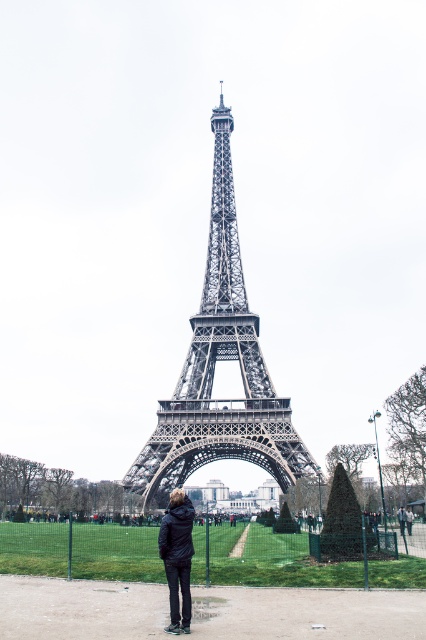
Between metallic structure at center and green grass at lower center, which one appears on the right side from the viewer's perspective?

metallic structure at center is more to the right.

Does metallic structure at center appear over green grass at lower center?

Correct, metallic structure at center is located above green grass at lower center.

Is point (203, 371) positioned before point (63, 531)?

Yes.

The image size is (426, 640). In order to click on metallic structure at center in this screenshot , I will do `click(213, 369)`.

What do you see at coordinates (213, 369) in the screenshot? The image size is (426, 640). I see `metallic structure at center` at bounding box center [213, 369].

Can you confirm if metallic structure at center is smaller than black matte jacket at lower center?

Actually, metallic structure at center might be larger than black matte jacket at lower center.

Is point (267, 461) farther from camera compared to point (158, 541)?

That is True.

The width and height of the screenshot is (426, 640). In order to click on metallic structure at center in this screenshot , I will do `click(213, 369)`.

Does point (0, 568) lie behind point (175, 612)?

Yes.

Which is behind, point (337, 566) or point (166, 532)?

Point (337, 566)

Find the location of a particular element. This screenshot has height=640, width=426. green grass at lower center is located at coordinates (275, 561).